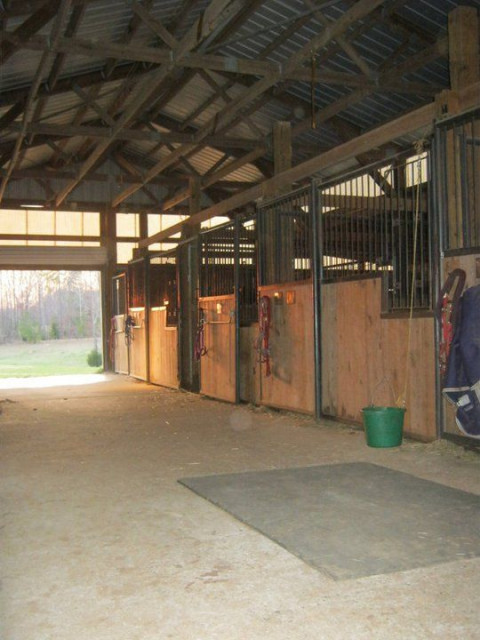
Where is `wooden beam`? The width and height of the screenshot is (480, 640). wooden beam is located at coordinates (6, 188), (63, 195), (126, 191), (181, 200), (221, 205), (350, 201).